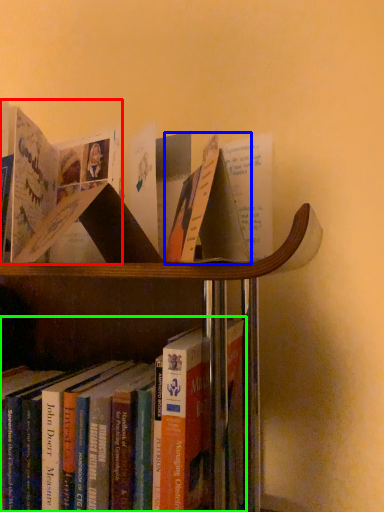
Question: Based on their relative distances, which object is nearer to book (highlighted by a red box)? Choose from paperback book (highlighted by a blue box) and book (highlighted by a green box).

Choices:
 (A) paperback book
 (B) book

Answer: (A)